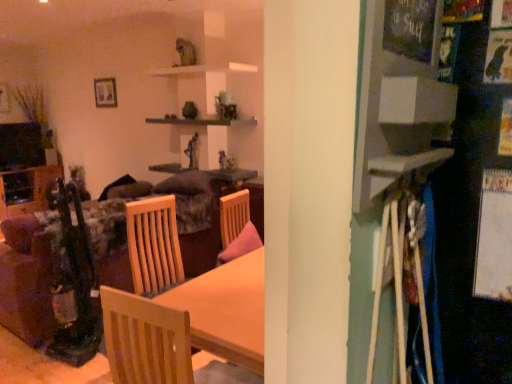
Question: From the image's perspective, does wooden table at center appear higher than velvet floral couch at left?

Choices:
 (A) no
 (B) yes

Answer: (B)

Question: Is wooden table at center oriented away from velvet floral couch at left?

Choices:
 (A) yes
 (B) no

Answer: (B)

Question: From the image's perspective, is wooden table at center beneath velvet floral couch at left?

Choices:
 (A) yes
 (B) no

Answer: (B)

Question: From a real-world perspective, is wooden table at center positioned over velvet floral couch at left based on gravity?

Choices:
 (A) yes
 (B) no

Answer: (A)

Question: Is wooden table at center to the left of velvet floral couch at left from the viewer's perspective?

Choices:
 (A) no
 (B) yes

Answer: (A)

Question: Considering the positions of wooden picture frame at upper left and velvet floral couch at left in the image, is wooden picture frame at upper left bigger or smaller than velvet floral couch at left?

Choices:
 (A) big
 (B) small

Answer: (B)

Question: Is wooden picture frame at upper left inside or outside of velvet floral couch at left?

Choices:
 (A) outside
 (B) inside

Answer: (A)

Question: From a real-world perspective, is wooden picture frame at upper left physically located above or below velvet floral couch at left?

Choices:
 (A) above
 (B) below

Answer: (A)

Question: In terms of width, does wooden picture frame at upper left look wider or thinner when compared to velvet floral couch at left?

Choices:
 (A) thin
 (B) wide

Answer: (A)

Question: Is wooden picture frame at upper left inside the boundaries of light wood chair at center, or outside?

Choices:
 (A) inside
 (B) outside

Answer: (B)

Question: In terms of height, does wooden picture frame at upper left look taller or shorter compared to light wood chair at center?

Choices:
 (A) short
 (B) tall

Answer: (A)

Question: From the image's perspective, is wooden picture frame at upper left positioned above or below light wood chair at center?

Choices:
 (A) above
 (B) below

Answer: (A)

Question: From a real-world perspective, is wooden picture frame at upper left physically located above or below light wood chair at center?

Choices:
 (A) above
 (B) below

Answer: (A)

Question: From their relative heights in the image, would you say velvet floral couch at left is taller or shorter than wooden table at center?

Choices:
 (A) tall
 (B) short

Answer: (A)

Question: Based on their sizes in the image, would you say velvet floral couch at left is bigger or smaller than wooden table at center?

Choices:
 (A) big
 (B) small

Answer: (A)